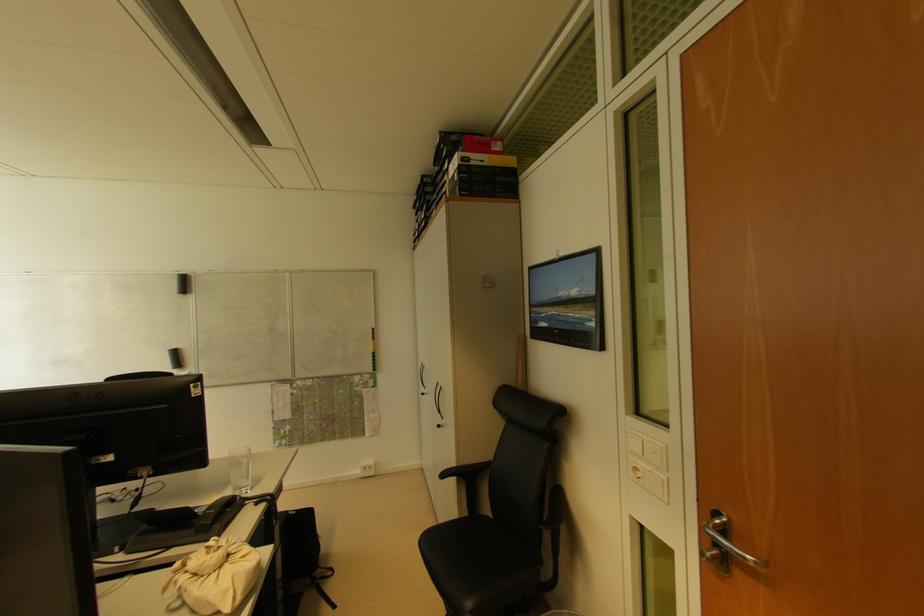
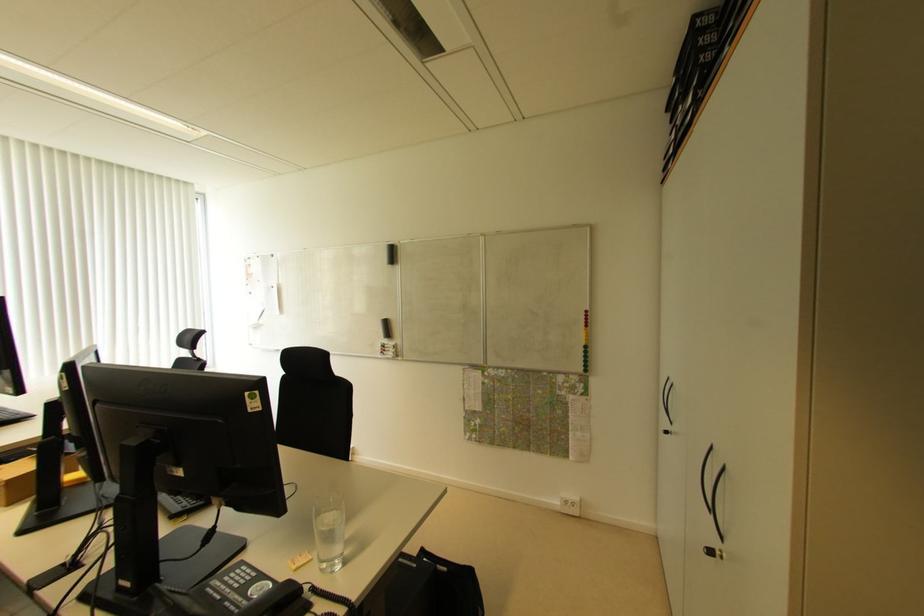
Question: The first image is from the beginning of the video and the second image is from the end. How did the camera likely rotate when shooting the video?

Choices:
 (A) Left
 (B) Right
 (C) Up
 (D) Down

Answer: (A)